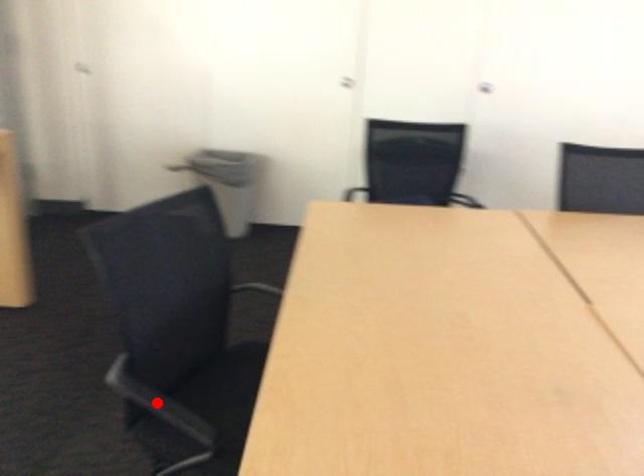
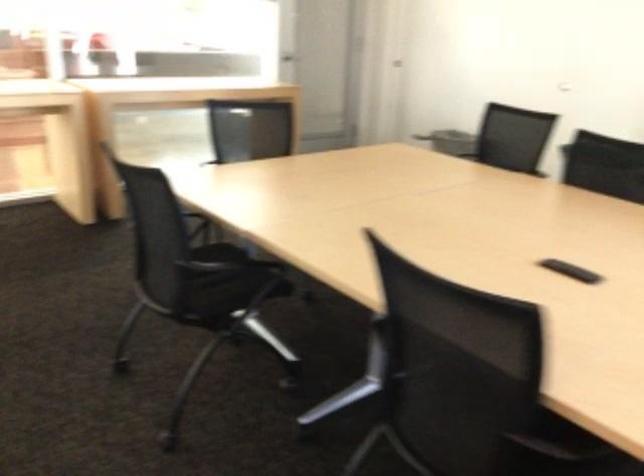
Question: I am providing you with two images of the same scene from different viewpoints. A red point is marked on the first image. Is the red point's position out of view in image 2?

Choices:
 (A) Yes
 (B) No

Answer: (A)